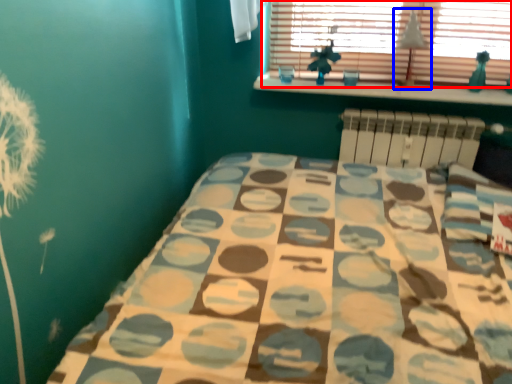
Question: Which of the following is the farthest to the observer, window (highlighted by a red box) or lamp (highlighted by a blue box)?

Choices:
 (A) window
 (B) lamp

Answer: (B)